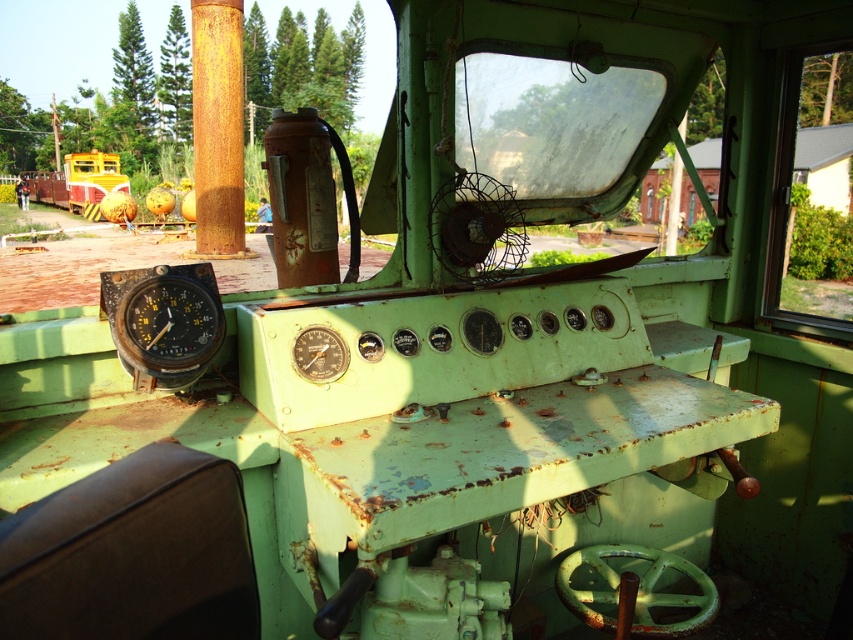
What is located at the coordinates point (78,180) in the vintage train control cabin?

At point (78,180) lies yellow painted metal train at left.

Based on the photo, you are a train engineer checking the control cabin. You notice the yellow painted metal train at left and the matte black gauge at center. Which object is taller?

The yellow painted metal train at left is much taller than the matte black gauge at center.

You are a train engineer in the control cabin. You need to reach a point behind the large round gauge with black face and yellow markings. Can you use the point at coordinates point (99, 216) and point (335, 371) to determine if it is accessible?

Point (99, 216) is behind point (335, 371), so the point behind the large round gauge with black face and yellow markings can be reached via point (99, 216) since it is positioned behind point (335, 371) which is in front of it.